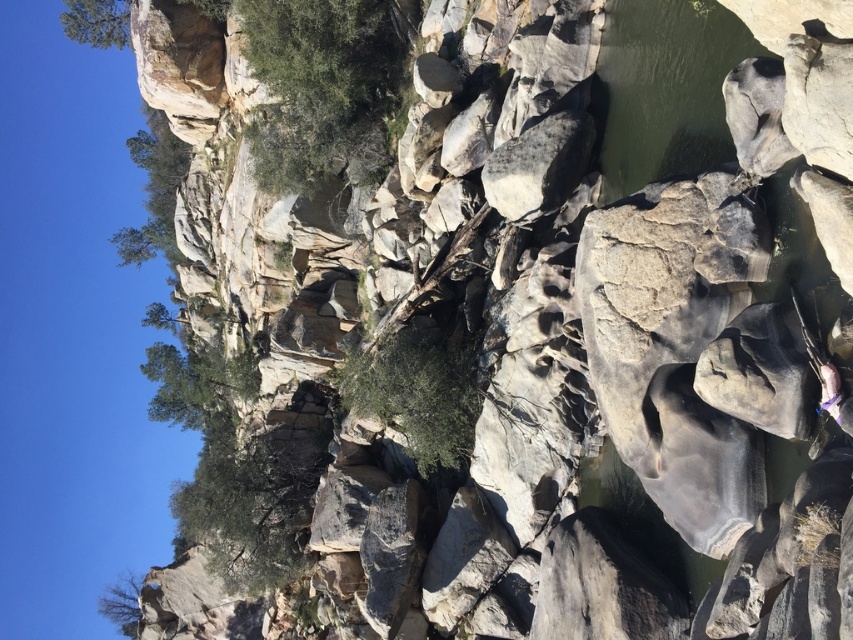
Is green leafy tree at upper center to the left of green smooth water at upper right from the viewer's perspective?

Correct, you'll find green leafy tree at upper center to the left of green smooth water at upper right.

Is green leafy tree at upper center taller than green smooth water at upper right?

Indeed, green leafy tree at upper center has a greater height compared to green smooth water at upper right.

Which is behind, point (364, 83) or point (616, 196)?

The point (364, 83) is behind.

I want to click on green leafy tree at upper center, so click(321, 90).

Does green leafy tree at upper left appear on the right side of green leafy tree at lower left?

Yes, green leafy tree at upper left is to the right of green leafy tree at lower left.

Which is in front, point (83, 20) or point (126, 586)?

Point (83, 20) is in front.

This screenshot has height=640, width=853. Identify the location of green leafy tree at upper left. (96, 20).

Does green leafy tree at upper center have a greater width compared to green leafy tree at lower left?

Incorrect, green leafy tree at upper center's width does not surpass green leafy tree at lower left's.

Locate an element on the screen. green leafy tree at upper center is located at coordinates (321, 90).

Does point (279, 166) lie behind point (119, 604)?

No, (279, 166) is in front of (119, 604).

Locate an element on the screen. This screenshot has width=853, height=640. green leafy tree at upper center is located at coordinates (321, 90).